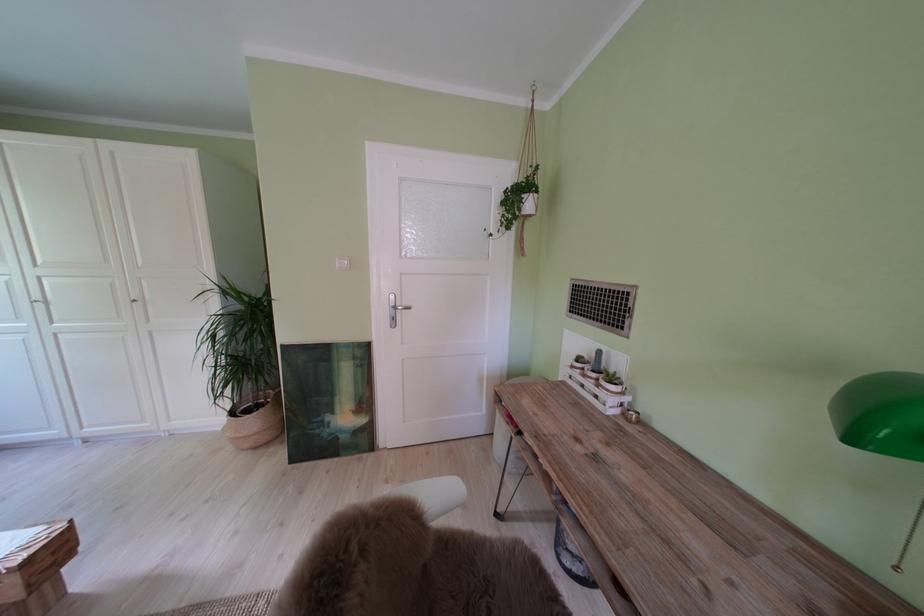
Find where to push the white light switch. Please return your answer as a coordinate pair (x, y).

(342, 262)